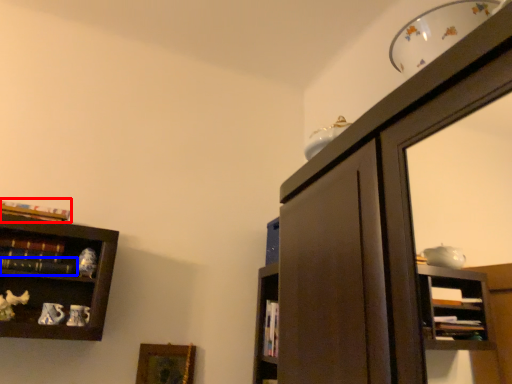
Question: Which of the following is the farthest to the observer, book (highlighted by a red box) or book (highlighted by a blue box)?

Choices:
 (A) book
 (B) book

Answer: (A)